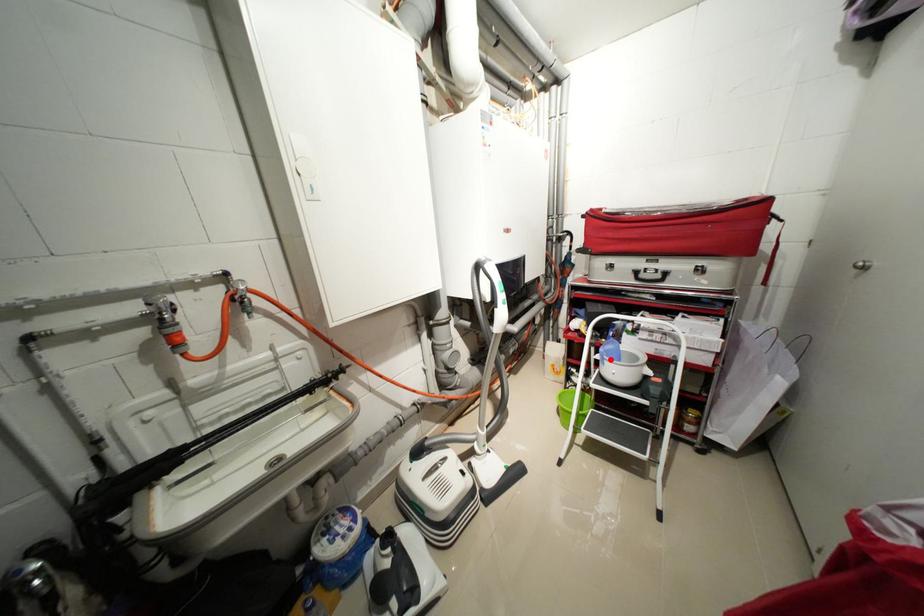
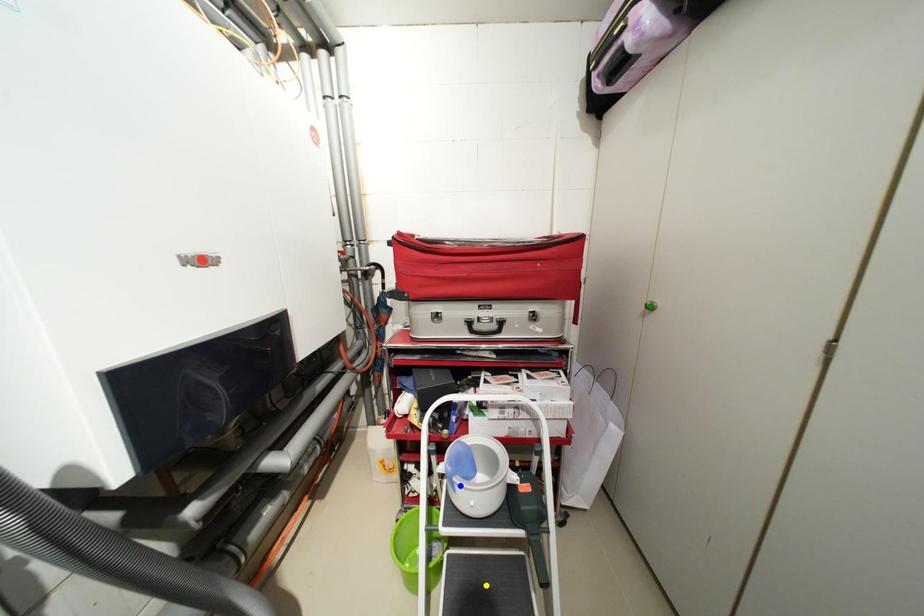
Question: I am providing you with two images of the same scene from different viewpoints. A red point is marked on the first image. You are given multiple points on the second image. Which point in image 2 is actually the same real-world point as the red point in image 1?

Choices:
 (A) blue point
 (B) green point
 (C) yellow point

Answer: (A)